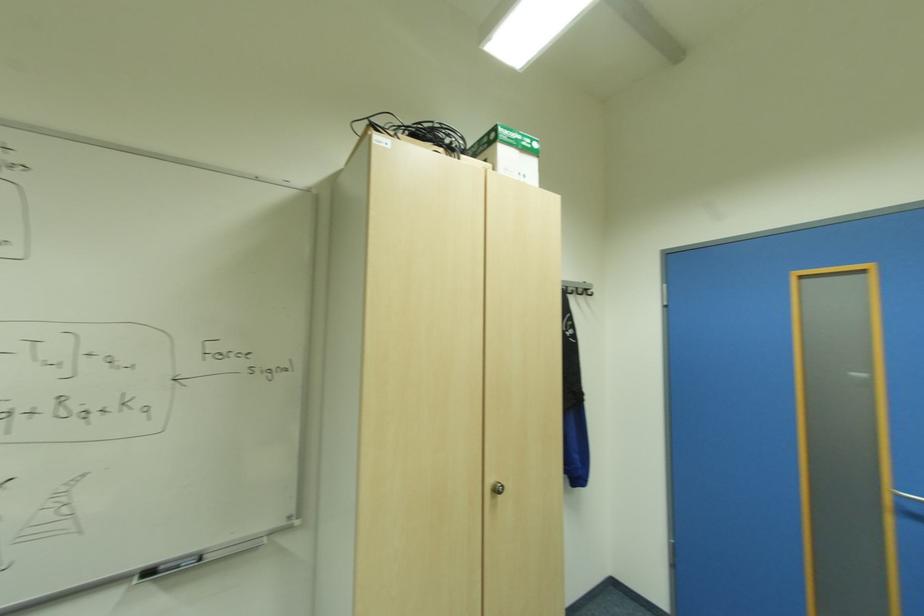
The height and width of the screenshot is (616, 924). What are the coordinates of `metal wall hook` in the screenshot? It's located at (577, 288).